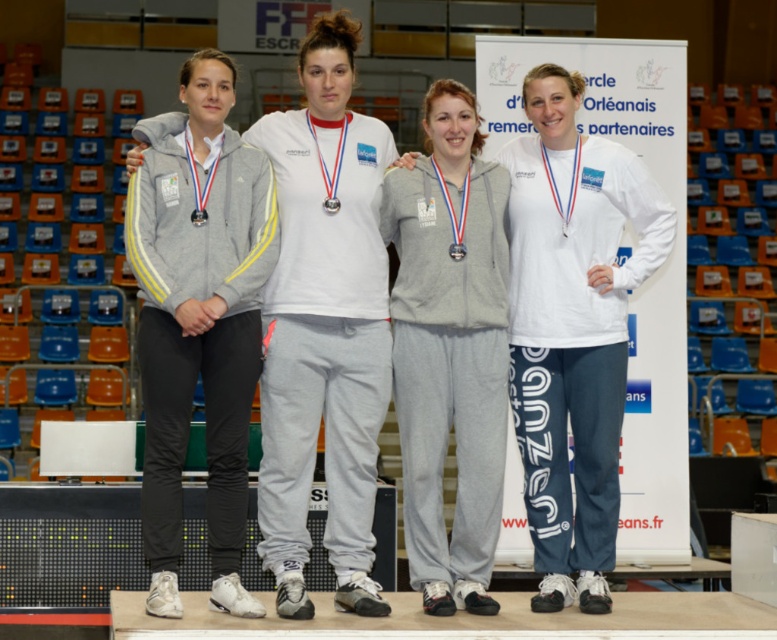
Question: Which object is the closest to the gray fleece sweatshirt at center?

Choices:
 (A) gray heathered tracksuit at center
 (B) metallic silver medal at center

Answer: (A)

Question: Does gray heathered tracksuit at center have a lesser width compared to metallic silver medal at center?

Choices:
 (A) no
 (B) yes

Answer: (A)

Question: Can you confirm if gray heathered tracksuit at center is positioned below metallic silver medal at center?

Choices:
 (A) yes
 (B) no

Answer: (A)

Question: Which point appears closest to the camera in this image?

Choices:
 (A) tap(657, 225)
 (B) tap(450, 243)

Answer: (B)

Question: Can you confirm if gray fleece sweatshirt at center is bigger than metallic silver medal at center?

Choices:
 (A) no
 (B) yes

Answer: (B)

Question: Which object is closer to the camera taking this photo?

Choices:
 (A) metallic silver medal at center
 (B) gray fleece sweatshirt at center

Answer: (B)